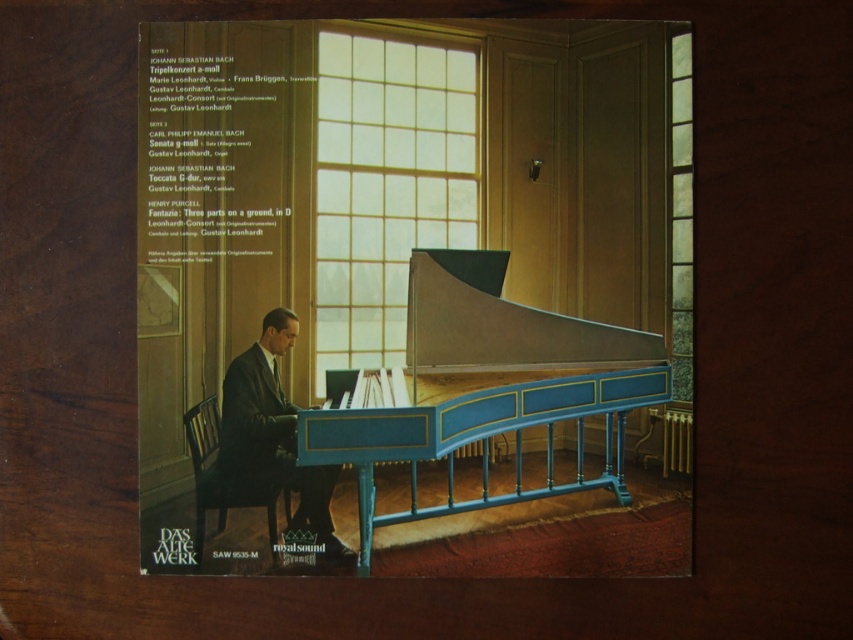
Consider the image. You are a photographer setting up a shoot in the room. You need to position a light source above the blue polished wood harpsichord at center and the dark suit at center. Since the harpsichord is much taller than the dark suit, which object requires a higher light placement?

The blue polished wood harpsichord at center is much taller than the dark suit at center, so the light source above the blue polished wood harpsichord at center needs to be placed higher to adequately illuminate it.

You are standing in the room and want to move from the dark suit at center to the blue polished wood harpsichord at center. Which direction should you move to reach it?

The blue polished wood harpsichord at center is to the right of the dark suit at center, so you should move to your right to reach it.

You are a photographer setting up for a shoot in this room. You need to position a light source to the left of the blue polished wood harpsichord at center and another to the right of the dark suit at center. Considering the space between the harpsichord and the suit, will there be enough room for both lights without them overlapping?

The blue polished wood harpsichord at center is wider than the dark suit at center. Since the harpsichord is at the center and the suit is also at the center, their positions might overlap, making it difficult to place lights on either side without them overlapping. However, since the harpsichord is wider, there might be sufficient space to position the lights appropriately, but this depends on the exact dimensions and arrangement of the objects.